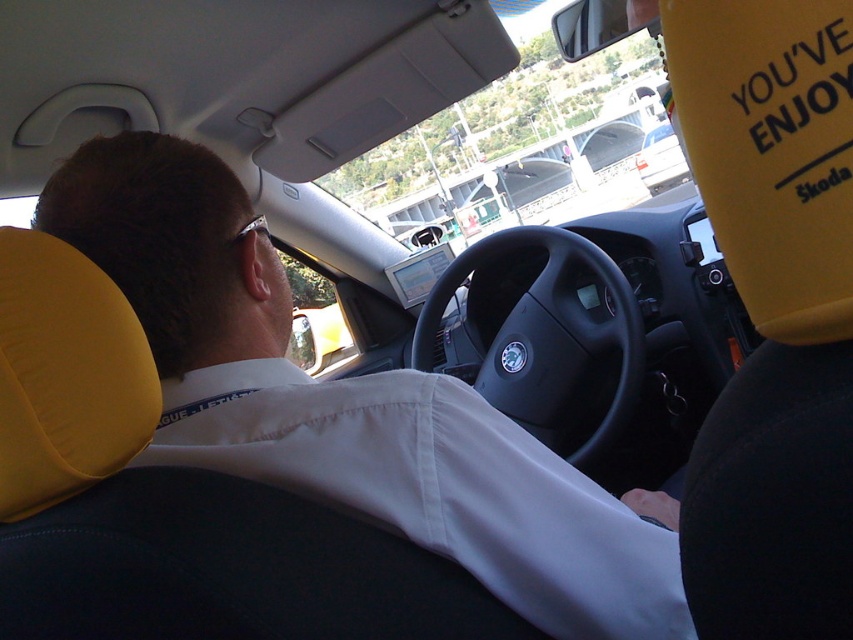
Question: Does white fabric shirt at upper left appear on the left side of black matte steering wheel at center?

Choices:
 (A) yes
 (B) no

Answer: (A)

Question: Among these objects, which one is nearest to the camera?

Choices:
 (A) black matte steering wheel at center
 (B) white matte van at center

Answer: (A)

Question: Which point appears closest to the camera in this image?

Choices:
 (A) (564, 348)
 (B) (674, 184)

Answer: (A)

Question: Is black matte steering wheel at center positioned before white matte van at center?

Choices:
 (A) no
 (B) yes

Answer: (B)

Question: Which point appears farthest from the camera in this image?

Choices:
 (A) [x=666, y=168]
 (B) [x=228, y=212]
 (C) [x=560, y=378]

Answer: (A)

Question: Is white fabric shirt at upper left bigger than black matte steering wheel at center?

Choices:
 (A) no
 (B) yes

Answer: (A)